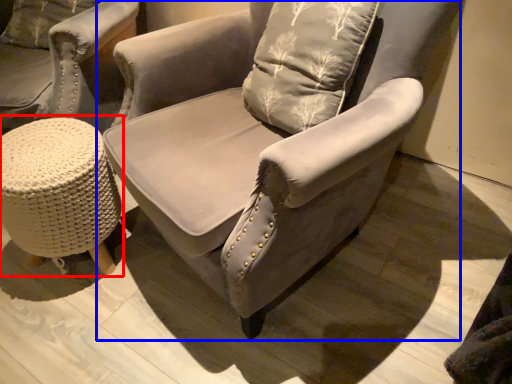
Question: Which object is closer to the camera taking this photo, music stool (highlighted by a red box) or chair (highlighted by a blue box)?

Choices:
 (A) music stool
 (B) chair

Answer: (B)